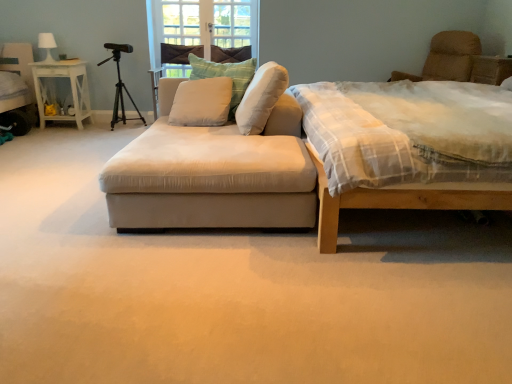
Question: Considering the relative sizes of white painted wood nightstand at left and black matte tripod at upper left in the image provided, is white painted wood nightstand at left bigger than black matte tripod at upper left?

Choices:
 (A) no
 (B) yes

Answer: (A)

Question: Is white painted wood nightstand at left smaller than black matte tripod at upper left?

Choices:
 (A) yes
 (B) no

Answer: (A)

Question: Is white painted wood nightstand at left turned away from black matte tripod at upper left?

Choices:
 (A) no
 (B) yes

Answer: (A)

Question: From a real-world perspective, is white painted wood nightstand at left located higher than black matte tripod at upper left?

Choices:
 (A) yes
 (B) no

Answer: (B)

Question: Could black matte tripod at upper left be considered to be inside white painted wood nightstand at left?

Choices:
 (A) yes
 (B) no

Answer: (B)

Question: Is white painted wood nightstand at left in front of or behind white fabric lampshade at upper left in the image?

Choices:
 (A) front
 (B) behind

Answer: (A)

Question: From the image's perspective, is white painted wood nightstand at left above or below white fabric lampshade at upper left?

Choices:
 (A) below
 (B) above

Answer: (A)

Question: Looking at their shapes, would you say white painted wood nightstand at left is wider or thinner than white fabric lampshade at upper left?

Choices:
 (A) thin
 (B) wide

Answer: (B)

Question: From a real-world perspective, relative to white fabric lampshade at upper left, is white painted wood nightstand at left vertically above or below?

Choices:
 (A) above
 (B) below

Answer: (B)

Question: Is beige fabric swivel chair at upper right spatially inside black matte tripod at upper left, or outside of it?

Choices:
 (A) outside
 (B) inside

Answer: (A)

Question: Looking at the image, does beige fabric swivel chair at upper right seem bigger or smaller compared to black matte tripod at upper left?

Choices:
 (A) big
 (B) small

Answer: (A)

Question: Is point (501, 74) closer or farther from the camera than point (113, 56)?

Choices:
 (A) farther
 (B) closer

Answer: (B)

Question: From a real-world perspective, is beige fabric swivel chair at upper right above or below black matte tripod at upper left?

Choices:
 (A) above
 (B) below

Answer: (A)

Question: Based on their sizes in the image, would you say light brown wooden bed at right is bigger or smaller than white painted wood nightstand at left?

Choices:
 (A) big
 (B) small

Answer: (A)

Question: Is point (393, 190) positioned closer to the camera than point (79, 66)?

Choices:
 (A) closer
 (B) farther

Answer: (A)